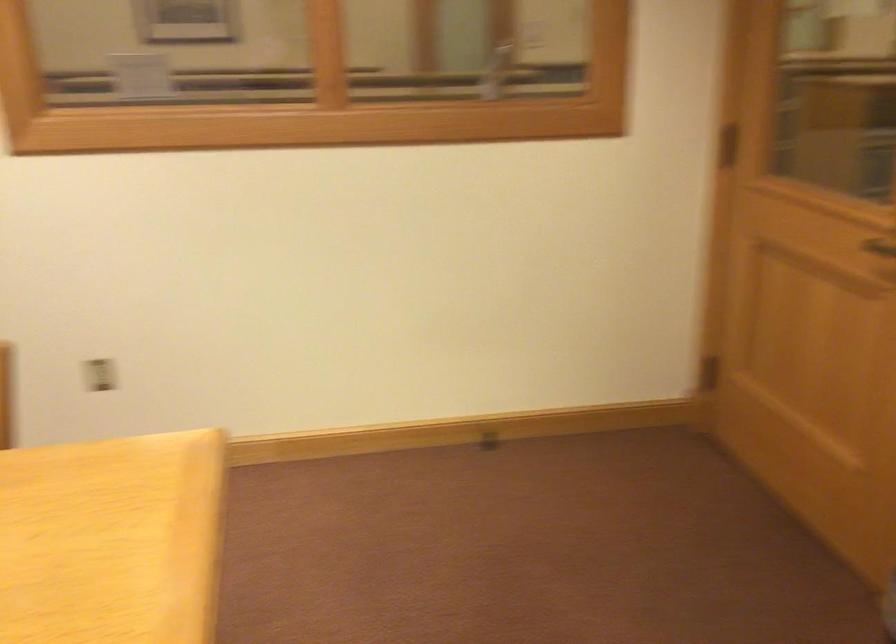
Where would you turn the black door handle? Please return your answer as a coordinate pair (x, y).

(881, 243)